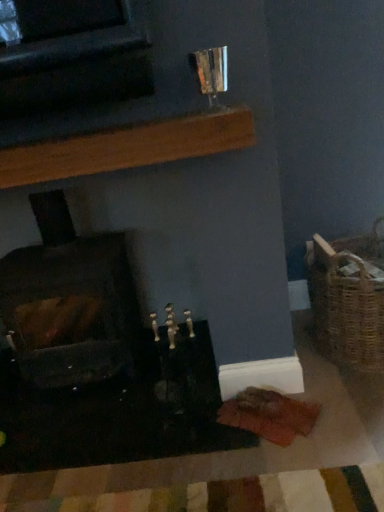
Question: From the image's perspective, is woven brown basket at right located beneath wooden plank at upper center?

Choices:
 (A) yes
 (B) no

Answer: (A)

Question: Does woven brown basket at right have a larger size compared to wooden plank at upper center?

Choices:
 (A) yes
 (B) no

Answer: (A)

Question: From a real-world perspective, is woven brown basket at right on wooden plank at upper center?

Choices:
 (A) yes
 (B) no

Answer: (B)

Question: Is woven brown basket at right at the left side of wooden plank at upper center?

Choices:
 (A) yes
 (B) no

Answer: (B)

Question: Does woven brown basket at right have a greater width compared to wooden plank at upper center?

Choices:
 (A) yes
 (B) no

Answer: (A)

Question: Is dark brown wood at left taller or shorter than woven brown basket at right?

Choices:
 (A) short
 (B) tall

Answer: (B)

Question: Which is correct: dark brown wood at left is inside woven brown basket at right, or outside of it?

Choices:
 (A) outside
 (B) inside

Answer: (A)

Question: Considering the positions of point (97, 291) and point (357, 330), is point (97, 291) closer or farther from the camera than point (357, 330)?

Choices:
 (A) closer
 (B) farther

Answer: (B)

Question: Is dark brown wood at left to the left or to the right of woven brown basket at right in the image?

Choices:
 (A) right
 (B) left

Answer: (B)

Question: Considering the relative positions of wooden plank at upper center and dark brown wood at left in the image provided, is wooden plank at upper center to the left or to the right of dark brown wood at left?

Choices:
 (A) right
 (B) left

Answer: (A)

Question: Is wooden plank at upper center spatially inside dark brown wood at left, or outside of it?

Choices:
 (A) inside
 (B) outside

Answer: (B)

Question: Is wooden plank at upper center wider or thinner than dark brown wood at left?

Choices:
 (A) wide
 (B) thin

Answer: (B)

Question: From the image's perspective, is wooden plank at upper center above or below dark brown wood at left?

Choices:
 (A) above
 (B) below

Answer: (A)

Question: Is wooden plank at upper center inside or outside of woven brown basket at right?

Choices:
 (A) outside
 (B) inside

Answer: (A)

Question: From a real-world perspective, is wooden plank at upper center physically located above or below woven brown basket at right?

Choices:
 (A) above
 (B) below

Answer: (A)